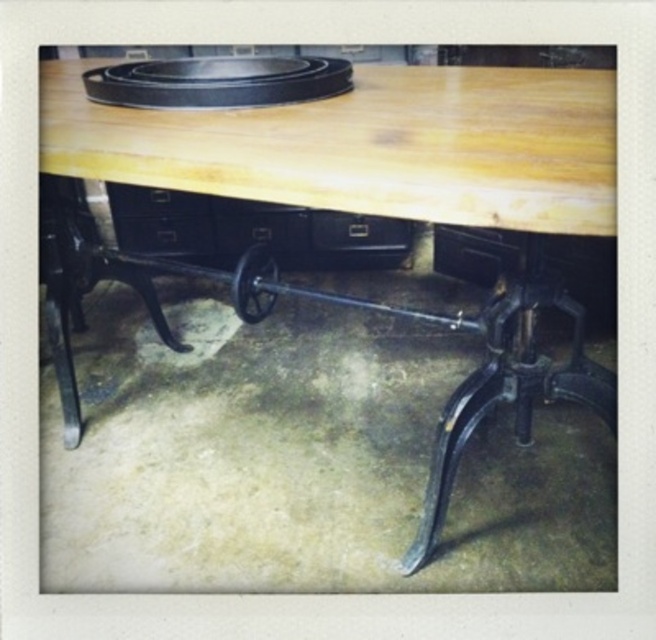
Can you confirm if natural wood table at center is shorter than black matte drawer at center?

Incorrect, natural wood table at center's height does not fall short of black matte drawer at center's.

Is natural wood table at center above black matte drawer at center?

No.

Between point (52, 209) and point (171, 246), which one is positioned in front?

Positioned in front is point (52, 209).

Locate an element on the screen. natural wood table at center is located at coordinates (344, 209).